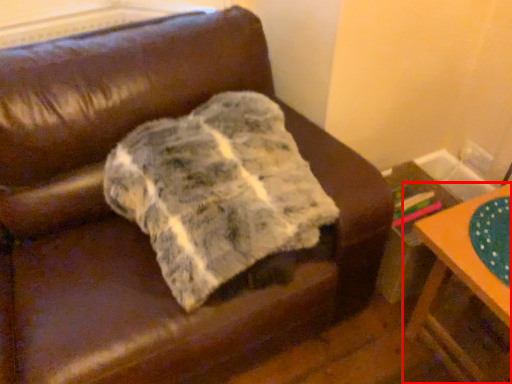
Question: Observing the image, what is the correct spatial positioning of table (annotated by the red box) in reference to blanket?

Choices:
 (A) left
 (B) right

Answer: (B)